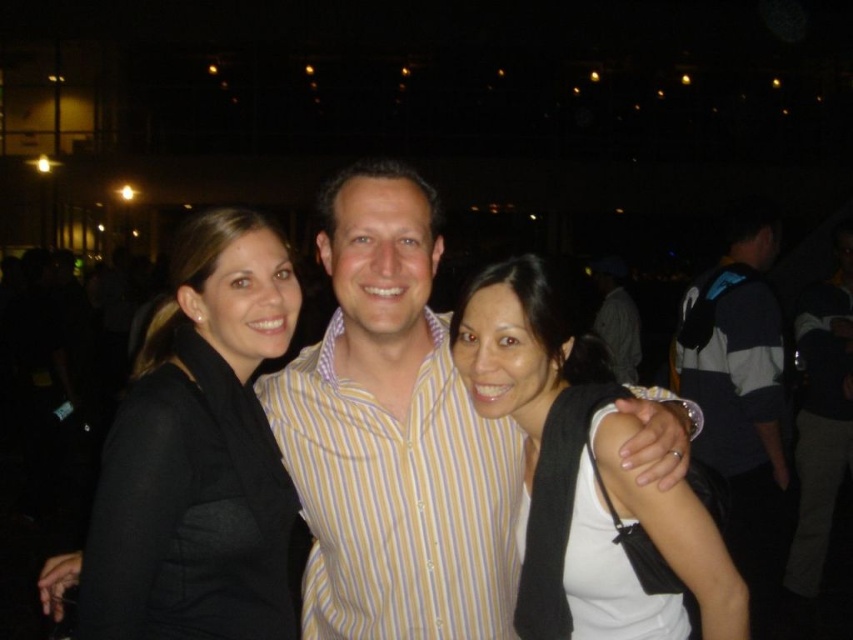
Question: Based on their relative distances, which object is farther from the black matte blazer at left?

Choices:
 (A) white matte shirt at center
 (B) black fabric at center
 (C) gray/white striped shirt at right
 (D) yellow striped shirt at center

Answer: (C)

Question: Which object is positioned farthest from the black fabric at center?

Choices:
 (A) white matte shirt at center
 (B) gray/white striped shirt at right

Answer: (B)

Question: Which of the following is the farthest from the observer?

Choices:
 (A) black fabric at center
 (B) gray/white striped shirt at right
 (C) yellow striped shirt at center

Answer: (B)

Question: Observing the image, what is the correct spatial positioning of black matte blazer at left in reference to yellow striped shirt at center?

Choices:
 (A) above
 (B) below

Answer: (A)

Question: Can you confirm if yellow striped shirt at center is positioned to the right of gray/white striped shirt at right?

Choices:
 (A) no
 (B) yes

Answer: (A)

Question: Observing the image, what is the correct spatial positioning of black fabric at center in reference to yellow striped shirt at center?

Choices:
 (A) left
 (B) right

Answer: (A)